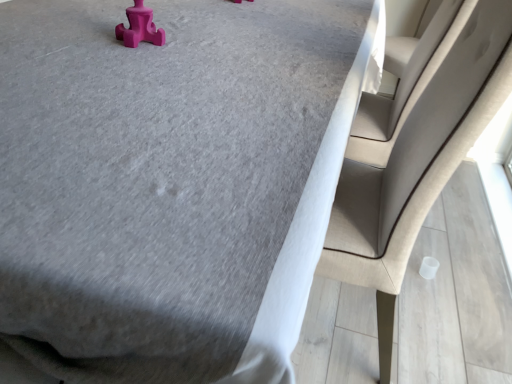
Where is `vacant position to the left of pink rubber toy at upper left`? The width and height of the screenshot is (512, 384). vacant position to the left of pink rubber toy at upper left is located at coordinates (68, 34).